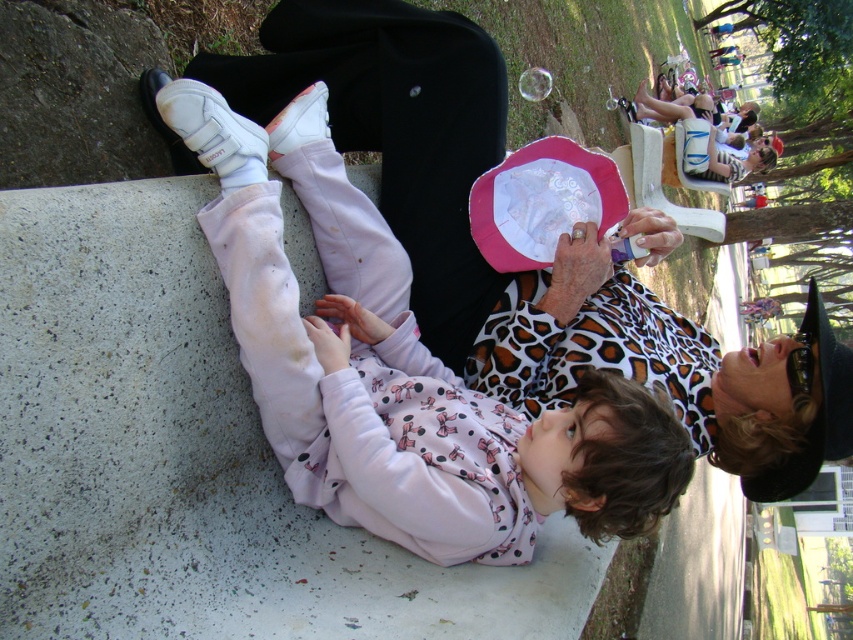
Question: Is pink fleece sweatshirt at lower center positioned in front of pink fabric paper plate at center?

Choices:
 (A) yes
 (B) no

Answer: (A)

Question: From the image, what is the correct spatial relationship of pink fleece sweatshirt at lower center in relation to pink fabric paper plate at center?

Choices:
 (A) left
 (B) right

Answer: (A)

Question: Considering the relative positions of pink fleece sweatshirt at lower center and pink fabric paper plate at center in the image provided, where is pink fleece sweatshirt at lower center located with respect to pink fabric paper plate at center?

Choices:
 (A) left
 (B) right

Answer: (A)